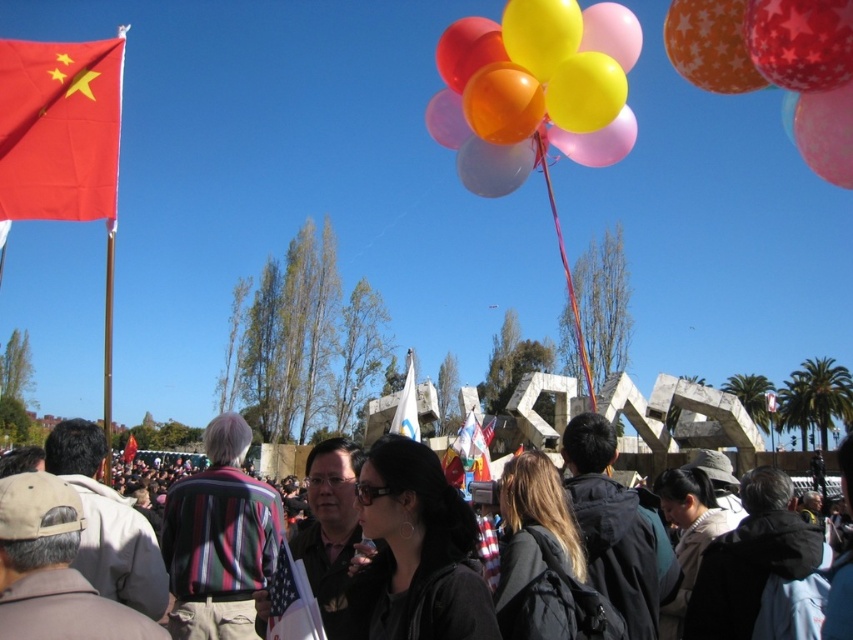
You are a photographer trying to capture a clear shot of the striped fabric shirt at center and the shiny metallic balloon at upper right. However, the balloon is partially obstructing your view of the shirt. Can you adjust your position to ensure both are visible without one blocking the other?

The shiny metallic balloon at upper right is behind the striped fabric shirt at center, so moving your position slightly to the side might allow you to see both without obstruction.

You are a photographer trying to capture a clear shot of the black hair at center and the matte black jacket at center. Since the scene is crowded, you need to adjust your zoom lens to focus on both subjects. Which subject should you zoom in on first to ensure it appears larger in the frame?

The matte black jacket at center is larger than the black hair at center, so you should zoom in on the matte black jacket at center first to ensure it appears larger in the frame.

You are a photographer standing in the crowd and want to take a photo of the striped fabric shirt at center and the shiny metallic balloon at upper right. Which object should you focus on first if you want to capture both in the same frame without moving the camera?

The striped fabric shirt at center is taller than the shiny metallic balloon at upper right, so you should focus on the striped fabric shirt at center first to ensure it fits within the frame.